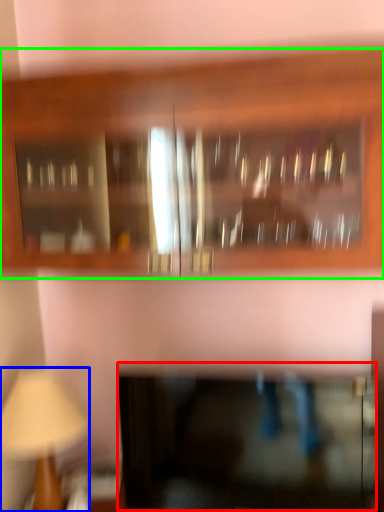
Question: Which object is the closest to the cabinetry (highlighted by a red box)? Choose among these: table lamp (highlighted by a blue box) or cabinetry (highlighted by a green box).

Choices:
 (A) table lamp
 (B) cabinetry

Answer: (A)